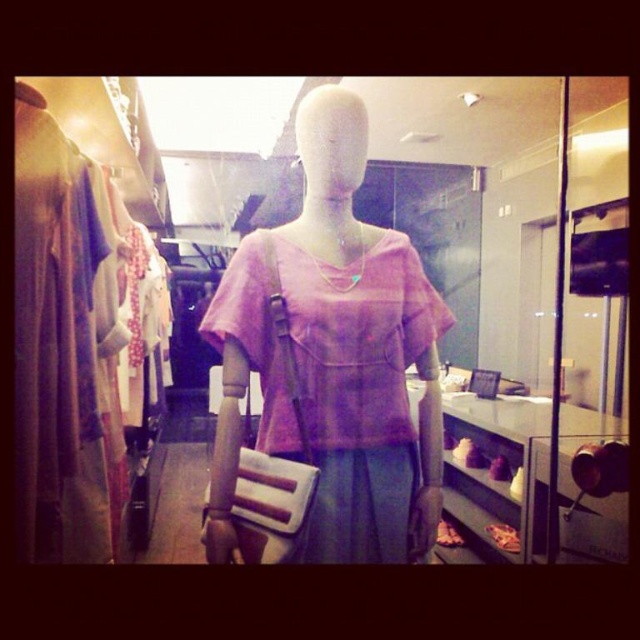
Question: Among these objects, which one is nearest to the camera?

Choices:
 (A) matte pink fabric dress at center
 (B) pink fabric dress at center

Answer: (B)

Question: Is matte pink fabric dress at center in front of pink fabric dress at center?

Choices:
 (A) yes
 (B) no

Answer: (B)

Question: Which point is closer to the camera taking this photo?

Choices:
 (A) (342, 467)
 (B) (353, 186)

Answer: (A)

Question: Is matte pink fabric dress at center closer to camera compared to pink fabric dress at center?

Choices:
 (A) no
 (B) yes

Answer: (A)

Question: Is matte pink fabric dress at center further to the viewer compared to pink fabric dress at center?

Choices:
 (A) yes
 (B) no

Answer: (A)